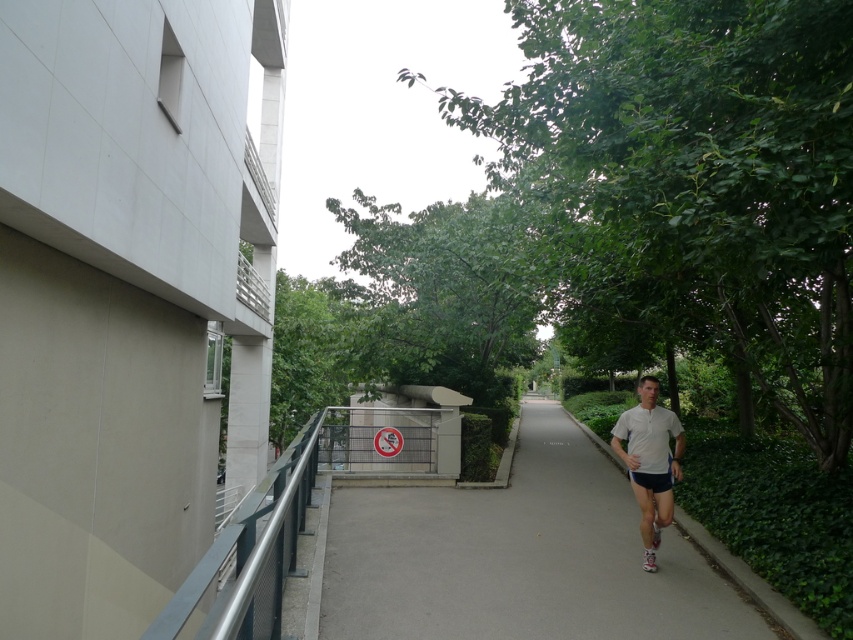
Who is more distant from viewer, (352, 637) or (645, 497)?

The point (645, 497) is more distant.

Does gray asphalt pavement at center have a lesser height compared to white matte shirt at center?

Indeed, gray asphalt pavement at center has a lesser height compared to white matte shirt at center.

What do you see at coordinates (519, 556) in the screenshot?
I see `gray asphalt pavement at center` at bounding box center [519, 556].

Locate an element on the screen. gray asphalt pavement at center is located at coordinates (519, 556).